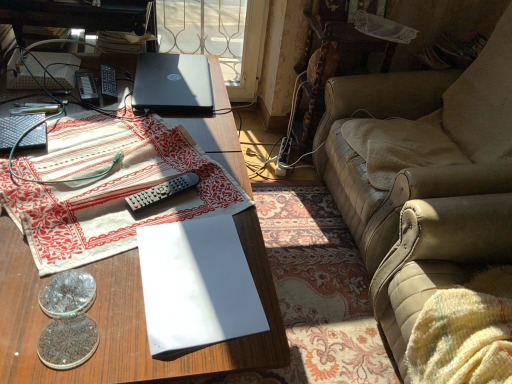
I want to click on vacant space in between gray plastic remote at center, the 3th remote control viewed from the back, and shiny metallic coin at lower left, placed as the 1th coin when sorted from back to front, so click(x=119, y=241).